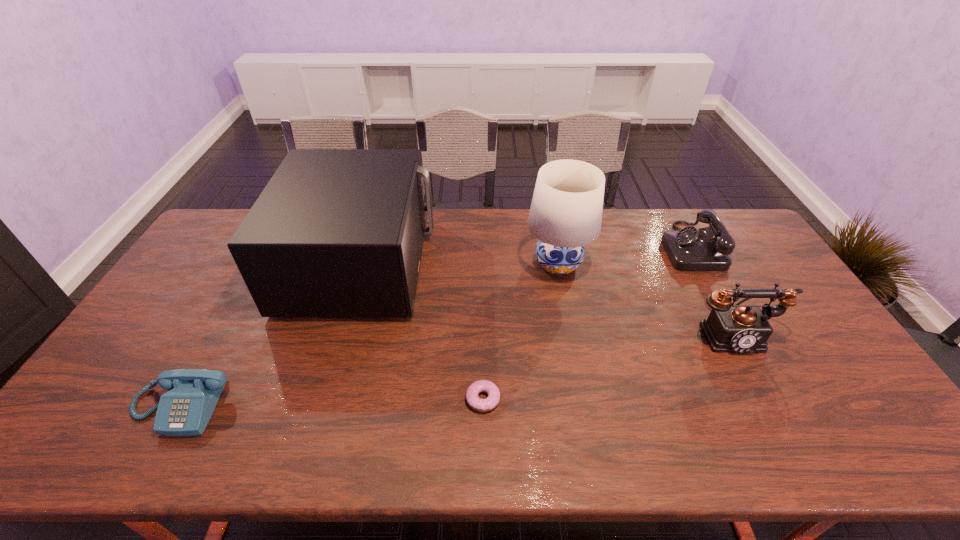
This screenshot has width=960, height=540. What are the coordinates of `vacant space located 0.130m on the front-facing side of the lampshade` in the screenshot? It's located at (568, 318).

Where is `free space located on the front-facing side of the microwave oven`? This screenshot has width=960, height=540. free space located on the front-facing side of the microwave oven is located at coordinates (540, 264).

Where is `vacant region located on the front of the third tallest object at the rotary dial`? Image resolution: width=960 pixels, height=540 pixels. vacant region located on the front of the third tallest object at the rotary dial is located at coordinates (763, 391).

What are the coordinates of `free space located 0.400m on the dial of the farthest telephone` in the screenshot? It's located at (548, 247).

Locate an element on the screen. The height and width of the screenshot is (540, 960). vacant space located on the dial of the farthest telephone is located at coordinates click(646, 247).

Where is `free location located on the dial of the farthest telephone`? This screenshot has width=960, height=540. free location located on the dial of the farthest telephone is located at coordinates (574, 247).

This screenshot has width=960, height=540. Identify the location of vacant space located 0.120m on the right of the doughnut. (548, 399).

Locate an element on the screen. lampshade at the far edge is located at coordinates (565, 215).

At what (x,y) coordinates should I click in order to perform the action: click on microwave oven present at the far edge. Please return your answer as a coordinate pair (x, y). The height and width of the screenshot is (540, 960). Looking at the image, I should click on pyautogui.click(x=336, y=232).

Image resolution: width=960 pixels, height=540 pixels. I want to click on telephone that is positioned at the far edge, so click(690, 249).